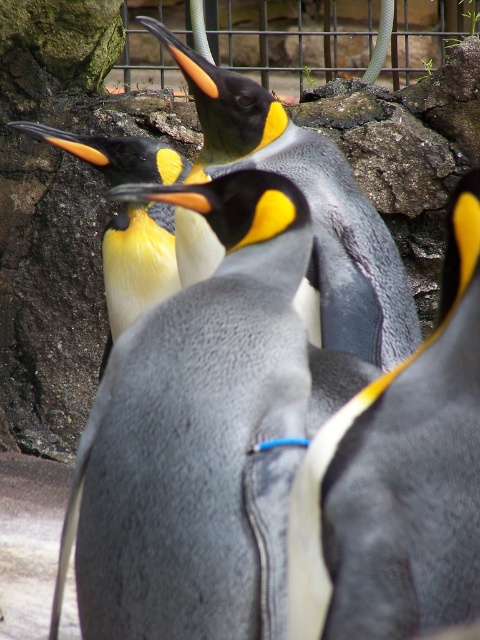
You are a researcher holding a 1.2 meter long pole. You want to reach the point at coordinates point (432, 396) in the image. Can your pole reach that point if you extend it fully?

The point point (432, 396) is 1.17 meters from camera, so yes, the pole can reach it since it is shorter than the pole length.

You are a zookeeper observing the penguins. You notice two penguins at the center of the enclosure. One has a gray matte appearance and the other is smooth gray. Which penguin is closer to you, the gray matte penguin at center or the smooth gray penguin at center?

The gray matte penguin at center is closer to you because the smooth gray penguin at center is positioned behind it.

You are a zookeeper observing the penguins in their enclosure. You notice a specific point marked at coordinates (398, 480). Which penguin does this point correspond to?

The point at coordinates (398, 480) marks the smooth gray penguin at center.